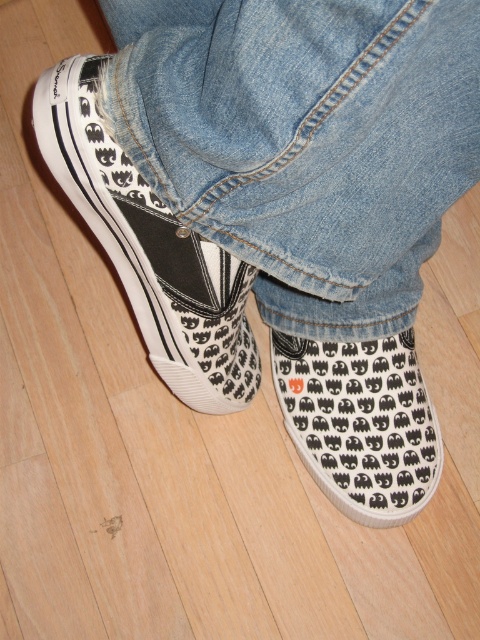
Question: Is canvas sneakers at lower left positioned in front of white canvas slip-on at lower center?

Choices:
 (A) yes
 (B) no

Answer: (A)

Question: Which object is closer to the camera taking this photo?

Choices:
 (A) canvas sneakers at lower left
 (B) denim at center

Answer: (B)

Question: Which point is farther from the camera taking this photo?

Choices:
 (A) (93, 124)
 (B) (291, 220)

Answer: (B)

Question: Which of the following is the farthest from the observer?

Choices:
 (A) denim at center
 (B) white canvas slip-on at lower center

Answer: (B)

Question: In this image, where is canvas sneakers at lower left located relative to white canvas slip-on at lower center?

Choices:
 (A) right
 (B) left

Answer: (B)

Question: Is canvas sneakers at lower left thinner than white canvas slip-on at lower center?

Choices:
 (A) yes
 (B) no

Answer: (B)